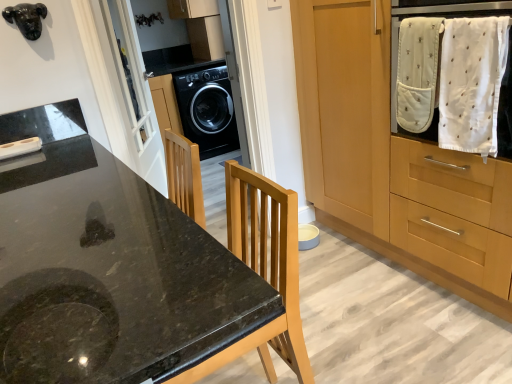
Question: Is black granite countertop at center beside white cotton towel at upper right?

Choices:
 (A) yes
 (B) no

Answer: (B)

Question: Is black granite countertop at center positioned in front of white cotton towel at upper right?

Choices:
 (A) no
 (B) yes

Answer: (B)

Question: Is black granite countertop at center oriented away from white cotton towel at upper right?

Choices:
 (A) yes
 (B) no

Answer: (A)

Question: Is black granite countertop at center aimed at white cotton towel at upper right?

Choices:
 (A) yes
 (B) no

Answer: (B)

Question: From a real-world perspective, is black granite countertop at center physically above white cotton towel at upper right?

Choices:
 (A) yes
 (B) no

Answer: (B)

Question: Based on their positions, is black glossy washing machine at center located to the left or right of wooden cabinet at right?

Choices:
 (A) right
 (B) left

Answer: (B)

Question: Considering the positions of point (206, 142) and point (419, 228), is point (206, 142) closer or farther from the camera than point (419, 228)?

Choices:
 (A) closer
 (B) farther

Answer: (B)

Question: Is black glossy washing machine at center inside the boundaries of wooden cabinet at right, or outside?

Choices:
 (A) outside
 (B) inside

Answer: (A)

Question: From the image's perspective, is black glossy washing machine at center positioned above or below wooden cabinet at right?

Choices:
 (A) above
 (B) below

Answer: (A)

Question: Is white glass screen door at upper left bigger or smaller than wooden cabinet at right?

Choices:
 (A) big
 (B) small

Answer: (B)

Question: In terms of width, does white glass screen door at upper left look wider or thinner when compared to wooden cabinet at right?

Choices:
 (A) thin
 (B) wide

Answer: (A)

Question: In terms of height, does white glass screen door at upper left look taller or shorter compared to wooden cabinet at right?

Choices:
 (A) short
 (B) tall

Answer: (A)

Question: From a real-world perspective, is white glass screen door at upper left positioned above or below wooden cabinet at right?

Choices:
 (A) below
 (B) above

Answer: (B)

Question: Based on their positions, is white glass screen door at upper left located to the left or right of white soft cloth at upper right?

Choices:
 (A) left
 (B) right

Answer: (A)

Question: In terms of size, does white glass screen door at upper left appear bigger or smaller than white soft cloth at upper right?

Choices:
 (A) small
 (B) big

Answer: (B)